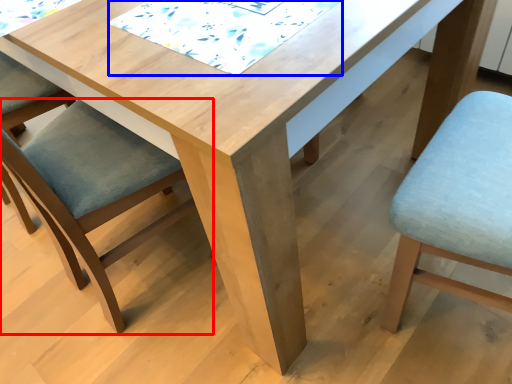
Question: Among these objects, which one is nearest to the camera, chair (highlighted by a red box) or quilt (highlighted by a blue box)?

Choices:
 (A) chair
 (B) quilt

Answer: (A)